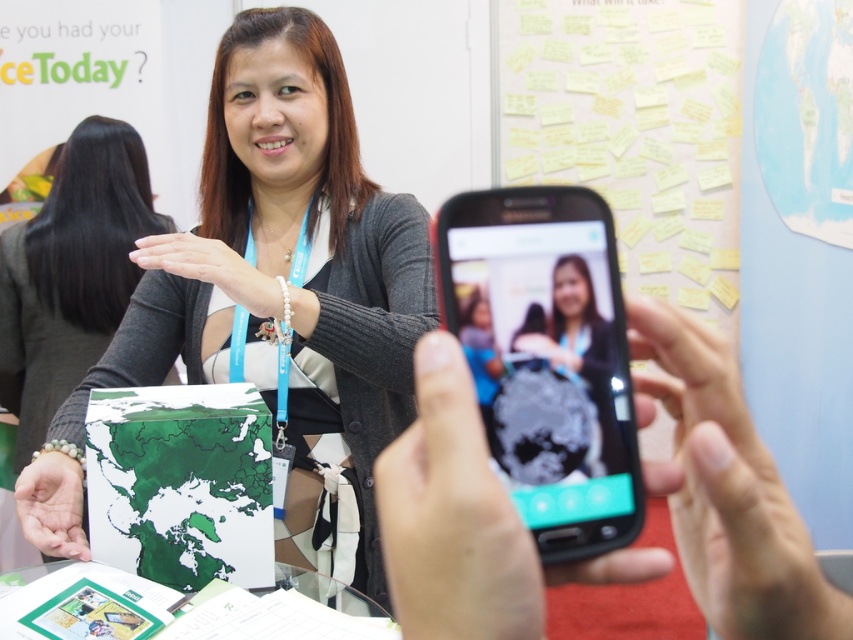
Is point (375, 205) positioned after point (61, 532)?

Yes, it is behind point (61, 532).

Does matte green map at center have a greater width compared to green matte map at lower left?

Correct, the width of matte green map at center exceeds that of green matte map at lower left.

Looking at this image, who is more forward, (67,400) or (44,528)?

Positioned in front is point (44,528).

Find the location of a particular element. This screenshot has height=640, width=853. matte green map at center is located at coordinates (283, 253).

Between point (305, 240) and point (222, 273), which one is positioned behind?

Positioned behind is point (305, 240).

Is point (402, 220) farther from viewer compared to point (225, 257)?

Yes.

At what (x,y) coordinates should I click in order to perform the action: click on matte green map at center. Please return your answer as a coordinate pair (x, y). The height and width of the screenshot is (640, 853). Looking at the image, I should click on [x=283, y=253].

Between point (480, 428) and point (94, 323), which one is positioned in front?

Positioned in front is point (480, 428).

Does point (503, 532) come closer to viewer compared to point (103, 164)?

Yes, point (503, 532) is in front of point (103, 164).

The height and width of the screenshot is (640, 853). Identify the location of black matte phone at center. (467, 520).